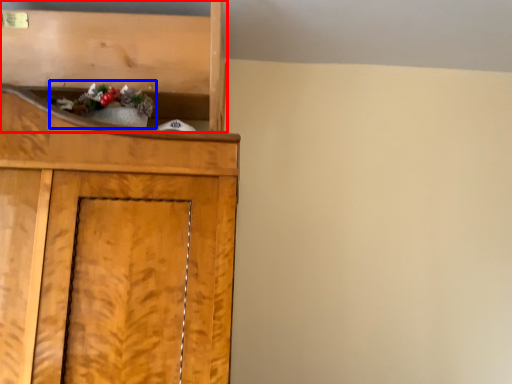
Question: Which of the following is the closest to the observer, shelf (highlighted by a red box) or christmas decoration (highlighted by a blue box)?

Choices:
 (A) shelf
 (B) christmas decoration

Answer: (B)